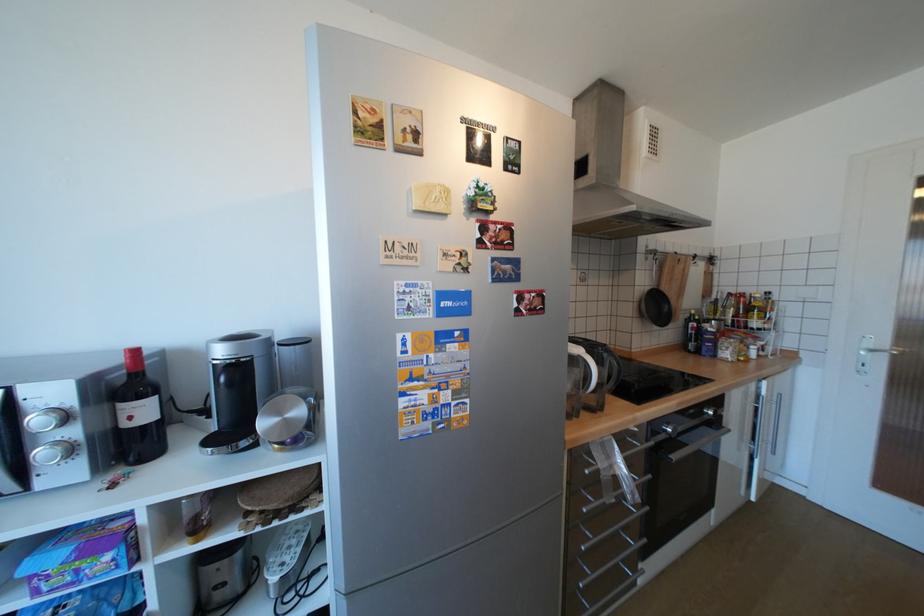
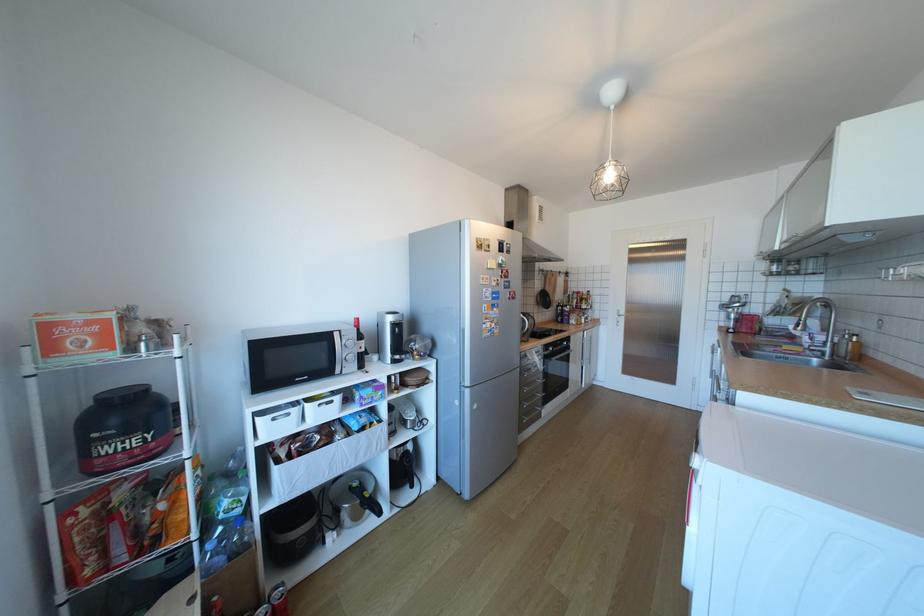
Where in the second image is the point corresponding to pixel 623 500 from the first image?

(543, 371)